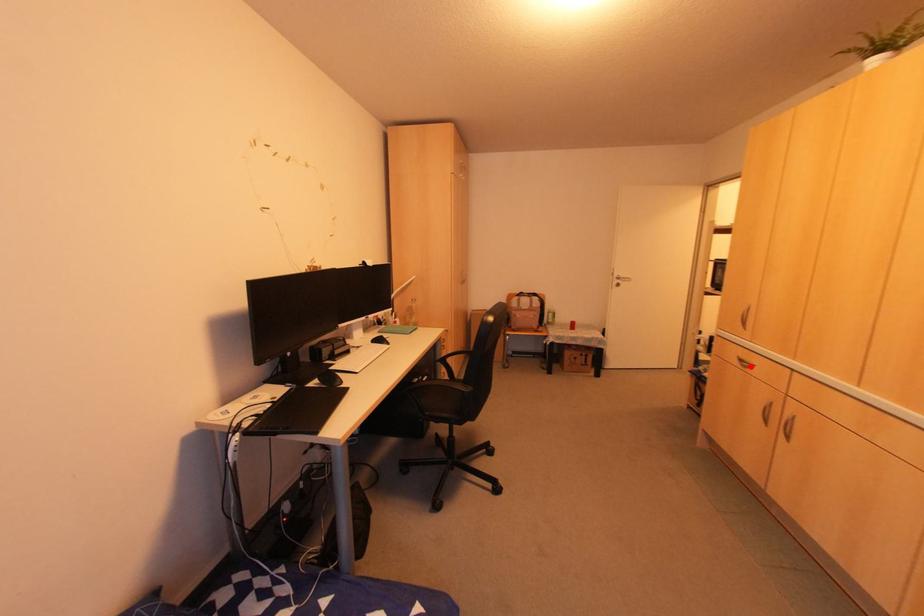
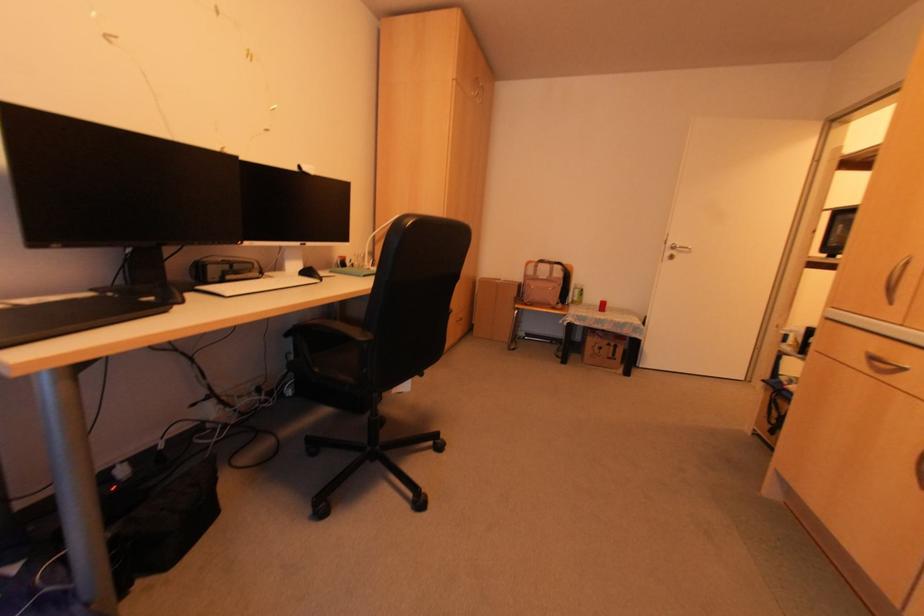
Locate, in the second image, the point that corresponds to the highlighted location in the first image.

(906, 371)